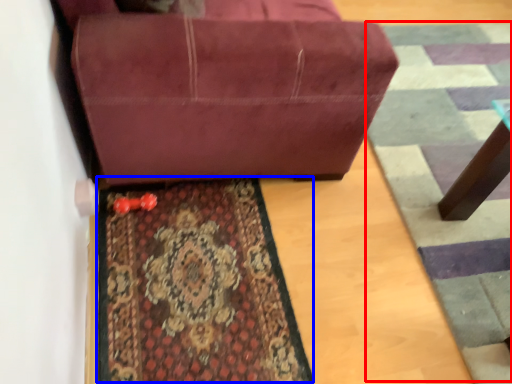
Question: Which point is closer to the camera, doormat (highlighted by a red box) or mat (highlighted by a blue box)?

Choices:
 (A) doormat
 (B) mat

Answer: (B)